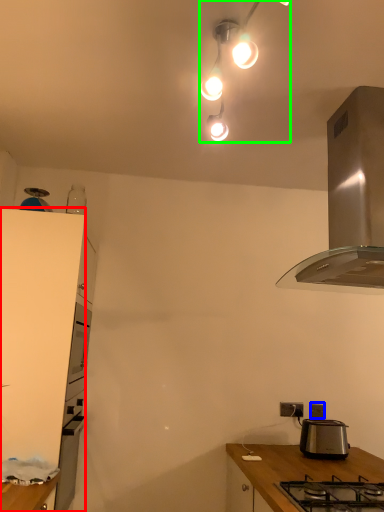
Question: Based on their relative distances, which object is farther from cabinetry (highlighted by a red box)? Choose from power outlet (highlighted by a blue box) and lamp (highlighted by a green box).

Choices:
 (A) power outlet
 (B) lamp

Answer: (A)